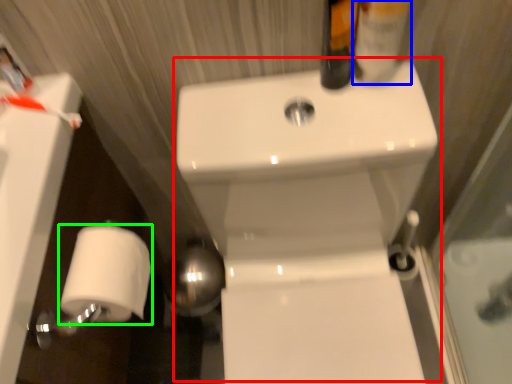
Question: Based on their relative distances, which object is nearer to sink (highlighted by a red box)? Choose from mouthwash (highlighted by a blue box) and toilet paper (highlighted by a green box).

Choices:
 (A) mouthwash
 (B) toilet paper

Answer: (A)